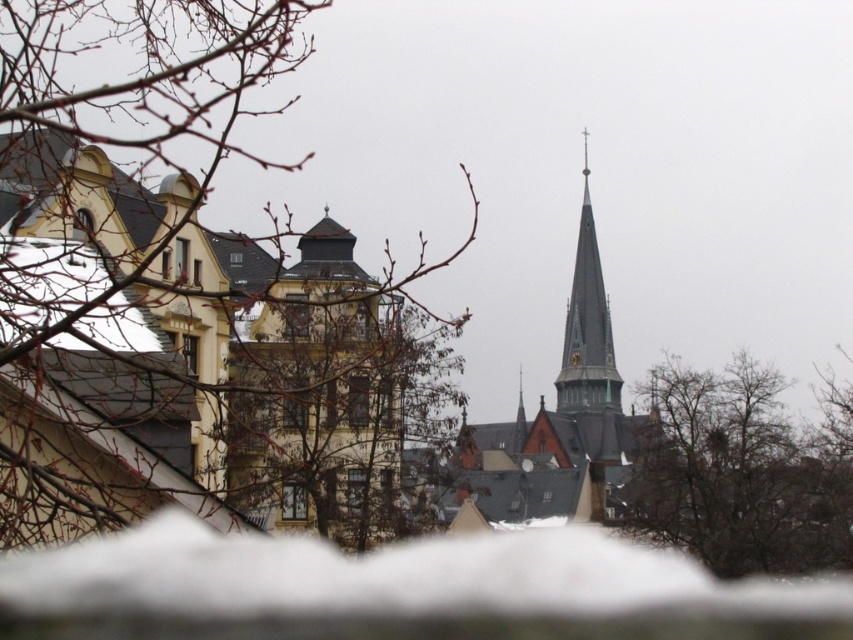
Is bare branches at left below white fluffy snow at lower center?

No.

Which is behind, point (277, 321) or point (817, 596)?

The point (817, 596) is more distant.

Is point (387, 448) less distant than point (251, 572)?

No, (387, 448) is further to viewer.

Where is `bare branches at left`? The image size is (853, 640). bare branches at left is located at coordinates (183, 289).

Looking at this image, can you confirm if bare branches at left is taller than gray stone church steeple at center?

Correct, bare branches at left is much taller as gray stone church steeple at center.

Does bare branches at left have a lesser height compared to gray stone church steeple at center?

No.

Consider the image. Who is more forward, (123, 385) or (469, 461)?

Point (123, 385) is in front.

The width and height of the screenshot is (853, 640). Find the location of `bare branches at left`. bare branches at left is located at coordinates (183, 289).

Who is more forward, (103, 481) or (712, 541)?

Positioned in front is point (103, 481).

Can you confirm if bare branches at left is wider than brown leafless tree at lower right?

Indeed, bare branches at left has a greater width compared to brown leafless tree at lower right.

Locate an element on the screen. bare branches at left is located at coordinates (183, 289).

You are a GUI agent. You are given a task and a screenshot of the screen. Output one action in this format:
    pyautogui.click(x=<x>, y=<y>)
    Task: Click on the bare branches at left
    The image size is (853, 640).
    Given the screenshot: What is the action you would take?
    pyautogui.click(x=183, y=289)